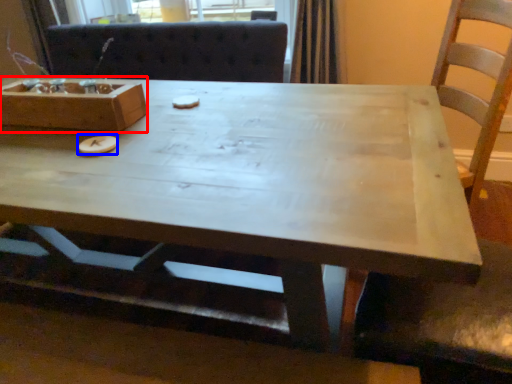
Question: Which object is closer to the camera taking this photo, box (highlighted by a red box) or food (highlighted by a blue box)?

Choices:
 (A) box
 (B) food

Answer: (B)